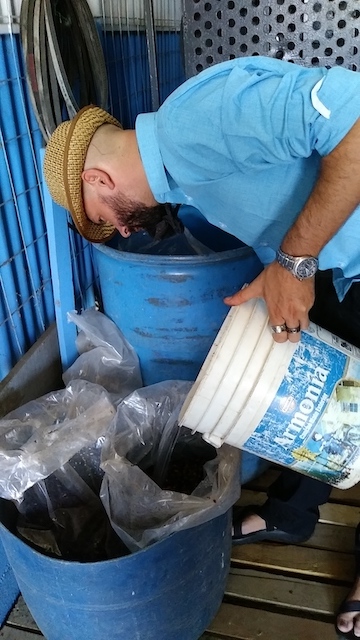
Locate an element on the screen. Image resolution: width=360 pixels, height=640 pixels. white bucket is located at coordinates (322, 417).